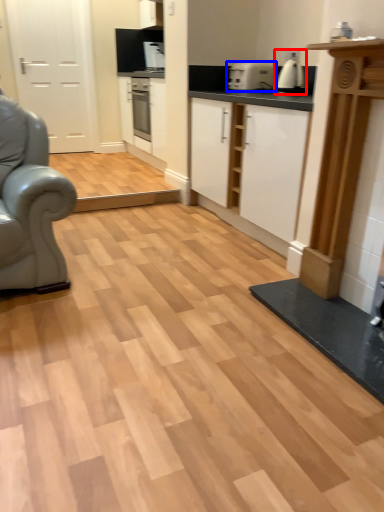
Question: Which of the following is the closest to the observer, coffee machine (highlighted by a red box) or appliance (highlighted by a blue box)?

Choices:
 (A) coffee machine
 (B) appliance

Answer: (A)